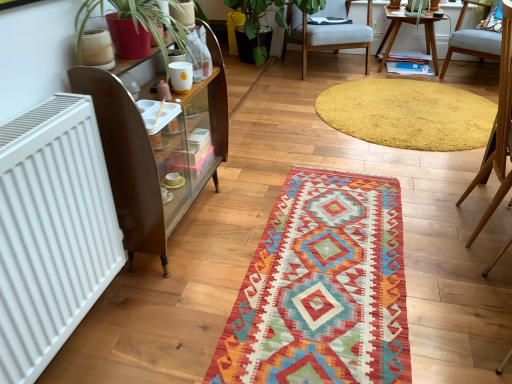
The height and width of the screenshot is (384, 512). What do you see at coordinates (322, 288) in the screenshot? I see `multicolored woven mat at center, which is the 2th mat in back-to-front order` at bounding box center [322, 288].

This screenshot has width=512, height=384. What do you see at coordinates (472, 41) in the screenshot?
I see `light gray fabric chair at upper right, which ranks as the 2th chair in back-to-front order` at bounding box center [472, 41].

The image size is (512, 384). What do you see at coordinates (393, 30) in the screenshot? I see `wooden table at upper right` at bounding box center [393, 30].

In order to face wooden table at upper right, should I rotate leftwards or rightwards?

You should look right and rotate roughly 19.685 degrees.

Locate an element on the screen. yellow shaggy rug at upper center, the second mat when ordered from front to back is located at coordinates (408, 114).

You are a GUI agent. You are given a task and a screenshot of the screen. Output one action in this format:
    pyautogui.click(x=<x>, y=<y>)
    Task: Click on the green matte plant at upper center
    
    Given the screenshot: What is the action you would take?
    pyautogui.click(x=265, y=15)

Where is `multicolored woven mat at center, the first mat when ordered from front to back`? The width and height of the screenshot is (512, 384). multicolored woven mat at center, the first mat when ordered from front to back is located at coordinates (322, 288).

Between yellow shaggy rug at upper center, which is the 2th mat from bottom to top, and wooden table at upper right, which one is positioned behind?

wooden table at upper right is further from the camera.

Is wooden table at upper right a part of yellow shaggy rug at upper center, which is the 2th mat from bottom to top?

Actually, wooden table at upper right is outside yellow shaggy rug at upper center, which is the 2th mat from bottom to top.

How many degrees apart are the facing directions of yellow shaggy rug at upper center, the 1th mat viewed from the back, and wooden table at upper right?

91.8 degrees.

Is yellow shaggy rug at upper center, the 1th mat viewed from the back, facing away from wooden table at upper right?

No, yellow shaggy rug at upper center, the 1th mat viewed from the back, is not facing the opposite direction of wooden table at upper right.

Considering the sizes of objects multicolored woven mat at center, placed as the first mat when sorted from bottom to top, and wooden table at upper right in the image provided, who is thinner, multicolored woven mat at center, placed as the first mat when sorted from bottom to top, or wooden table at upper right?

wooden table at upper right.

Is multicolored woven mat at center, the first mat when ordered from front to back, aimed at wooden table at upper right?

No, multicolored woven mat at center, the first mat when ordered from front to back, is not facing towards wooden table at upper right.

Is multicolored woven mat at center, which is the 2th mat in back-to-front order, not close to wooden table at upper right?

Indeed, multicolored woven mat at center, which is the 2th mat in back-to-front order, is not near wooden table at upper right.

Is multicolored woven mat at center, which is the 2th mat in back-to-front order, positioned beyond the bounds of wooden table at upper right?

Yes.

Find the location of a particular element. The width and height of the screenshot is (512, 384). shelf that appears on the left of light blue fabric chair at right, the 2th chair from the left is located at coordinates (152, 155).

Is light blue fabric chair at right, the 2th chair from the left, bigger or smaller than brown wooden shelf at left?

Considering their sizes, light blue fabric chair at right, the 2th chair from the left, takes up less space than brown wooden shelf at left.

Considering the positions of point (458, 200) and point (113, 122), is point (458, 200) closer or farther from the camera than point (113, 122)?

Point (458, 200).

Could you tell me if light blue fabric chair at right, which is the 1th chair from front to back, is facing brown wooden shelf at left?

No, light blue fabric chair at right, which is the 1th chair from front to back, is not turned towards brown wooden shelf at left.

How different are the orientations of green matte plant at upper center and multicolored woven mat at center, the 2th mat positioned from the top, in degrees?

The facing directions of green matte plant at upper center and multicolored woven mat at center, the 2th mat positioned from the top, are 89.9 degrees apart.

Considering the positions of point (249, 15) and point (386, 256), is point (249, 15) closer or farther from the camera than point (386, 256)?

Clearly, point (249, 15) is more distant from the camera than point (386, 256).

From a real-world perspective, is green matte plant at upper center positioned above or below multicolored woven mat at center, placed as the first mat when sorted from bottom to top?

In terms of real-world spatial position, green matte plant at upper center is above multicolored woven mat at center, placed as the first mat when sorted from bottom to top.

From the image's perspective, is green matte plant at upper center under multicolored woven mat at center, the first mat when ordered from front to back?

No, from the image's perspective, green matte plant at upper center is not beneath multicolored woven mat at center, the first mat when ordered from front to back.

From the picture: Between yellow shaggy rug at upper center, which appears as the 1th mat when viewed from the top, and light blue fabric chair at right, placed as the second chair when sorted from right to left, which one appears on the left side from the viewer's perspective?

light blue fabric chair at right, placed as the second chair when sorted from right to left.

Considering the relative sizes of yellow shaggy rug at upper center, which is the 2th mat from bottom to top, and light blue fabric chair at right, which is the third chair from back to front, in the image provided, is yellow shaggy rug at upper center, which is the 2th mat from bottom to top, wider than light blue fabric chair at right, which is the third chair from back to front,?

Correct, the width of yellow shaggy rug at upper center, which is the 2th mat from bottom to top, exceeds that of light blue fabric chair at right, which is the third chair from back to front.

Considering the sizes of yellow shaggy rug at upper center, which appears as the 1th mat when viewed from the top, and light blue fabric chair at right, placed as the second chair when sorted from right to left, in the image, is yellow shaggy rug at upper center, which appears as the 1th mat when viewed from the top, taller or shorter than light blue fabric chair at right, placed as the second chair when sorted from right to left,?

yellow shaggy rug at upper center, which appears as the 1th mat when viewed from the top, is shorter than light blue fabric chair at right, placed as the second chair when sorted from right to left.

Could you tell me if green matte plant at upper center is turned towards wooden table at upper right?

No.

How much distance is there between green matte plant at upper center and wooden table at upper right?

A distance of 36.52 inches exists between green matte plant at upper center and wooden table at upper right.

Looking at this image, is green matte plant at upper center positioned behind wooden table at upper right?

No, green matte plant at upper center is closer to the camera.

From the image's perspective, who appears lower, multicolored woven mat at center, the first mat when ordered from front to back, or green matte plant at upper center?

multicolored woven mat at center, the first mat when ordered from front to back, from the image's perspective.

In the scene shown: How different are the orientations of multicolored woven mat at center, the first mat when ordered from front to back, and green matte plant at upper center in degrees?

89.9 degrees.

Is point (388, 353) in front of point (254, 33)?

Yes, it is in front of point (254, 33).

Is green matte plant at upper center surrounded by multicolored woven mat at center, the 2th mat positioned from the top?

No.

Where is `mat that is the 1st one below the wooden table at upper right (from a real-world perspective)`? Image resolution: width=512 pixels, height=384 pixels. mat that is the 1st one below the wooden table at upper right (from a real-world perspective) is located at coordinates (408, 114).

This screenshot has width=512, height=384. Identify the location of the 2nd mat counting from the left of the wooden table at upper right. (322, 288).

Considering their positions, is green matte plant at upper center positioned further to light gray fabric chair at upper right, placed as the first chair when sorted from right to left, than white matte radiator at left?

Among the two, white matte radiator at left is located further to light gray fabric chair at upper right, placed as the first chair when sorted from right to left.

When comparing their distances from yellow shaggy rug at upper center, which is the 2th mat from bottom to top, does light gray fabric chair at upper right, which ranks as the 2th chair in back-to-front order, or brown wooden shelf at left seem further?

Among the two, brown wooden shelf at left is located further to yellow shaggy rug at upper center, which is the 2th mat from bottom to top.

Considering their positions, is light gray fabric chair at center, the 3th chair in the front-to-back sequence, positioned closer to brown wooden shelf at left than white matte radiator at left?

Based on the image, white matte radiator at left appears to be nearer to brown wooden shelf at left.

Based on the photo, which object lies nearer to the anchor point light gray fabric chair at upper right, placed as the first chair when sorted from right to left, light blue fabric chair at right, which is the third chair from back to front, or brown wooden shelf at left?

Based on the image, light blue fabric chair at right, which is the third chair from back to front, appears to be nearer to light gray fabric chair at upper right, placed as the first chair when sorted from right to left.

Considering their positions, is light gray fabric chair at upper right, which ranks as the 2th chair in back-to-front order, positioned closer to white matte radiator at left than brown wooden shelf at left?

brown wooden shelf at left is closer to white matte radiator at left.

From the picture: Considering their positions, is light blue fabric chair at right, which is the third chair from back to front, positioned closer to yellow shaggy rug at upper center, which appears as the 1th mat when viewed from the top, than green matte plant at upper center?

Among the two, light blue fabric chair at right, which is the third chair from back to front, is located nearer to yellow shaggy rug at upper center, which appears as the 1th mat when viewed from the top.

Based on their spatial positions, is wooden table at upper right or light gray fabric chair at center, the 3th chair when ordered from right to left, further from brown wooden shelf at left?

Among the two, wooden table at upper right is located further to brown wooden shelf at left.

Looking at the image, which one is located closer to yellow shaggy rug at upper center, which appears as the 1th mat when viewed from the top, white matte radiator at left or multicolored woven mat at center, placed as the first mat when sorted from bottom to top?

Among the two, multicolored woven mat at center, placed as the first mat when sorted from bottom to top, is located nearer to yellow shaggy rug at upper center, which appears as the 1th mat when viewed from the top.

I want to click on mat located between multicolored woven mat at center, the 2th mat positioned from the top, and light gray fabric chair at upper right, which ranks as the 2th chair in back-to-front order, in the depth direction, so click(408, 114).

The image size is (512, 384). In order to click on shelf between multicolored woven mat at center, which is the 2th mat in back-to-front order, and wooden table at upper right from front to back in this screenshot , I will do `click(152, 155)`.

Identify the location of shelf between white matte radiator at left and yellow shaggy rug at upper center, which is the 2th mat from bottom to top, in the horizontal direction. (152, 155).

Locate an element on the screen. The image size is (512, 384). mat between light blue fabric chair at right, which is the 1th chair from front to back, and green matte plant at upper center, along the z-axis is located at coordinates (408, 114).